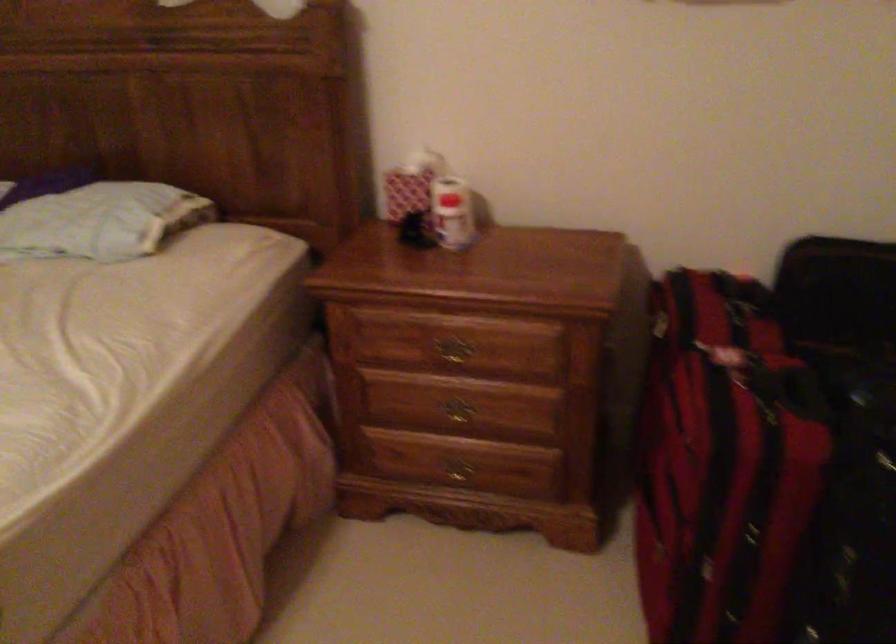
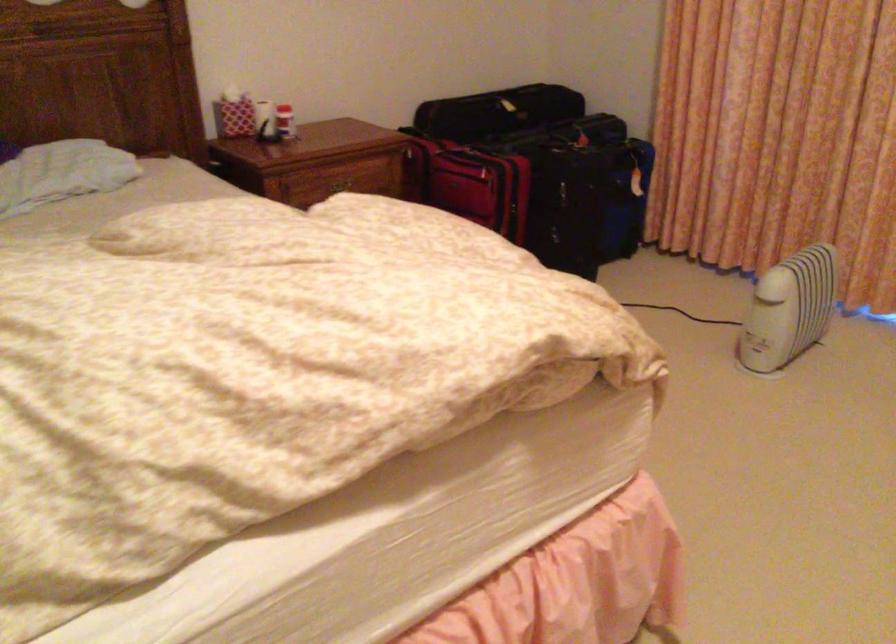
Question: I am providing you with two images of the same scene from different viewpoints. Please identify which objects are invisible in image2.

Choices:
 (A) wooden drawer handle
 (B) red and white bottle
 (C) brass drawer handle
 (D) black and green pen

Answer: (C)